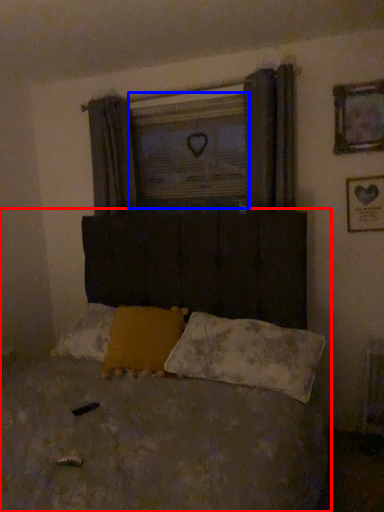
Question: Which of the following is the farthest to the observer, bed (highlighted by a red box) or window screen (highlighted by a blue box)?

Choices:
 (A) bed
 (B) window screen

Answer: (B)